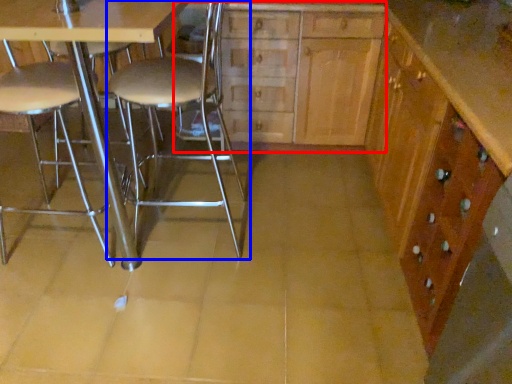
Question: Which object is further to the camera taking this photo, dresser (highlighted by a red box) or chair (highlighted by a blue box)?

Choices:
 (A) dresser
 (B) chair

Answer: (A)